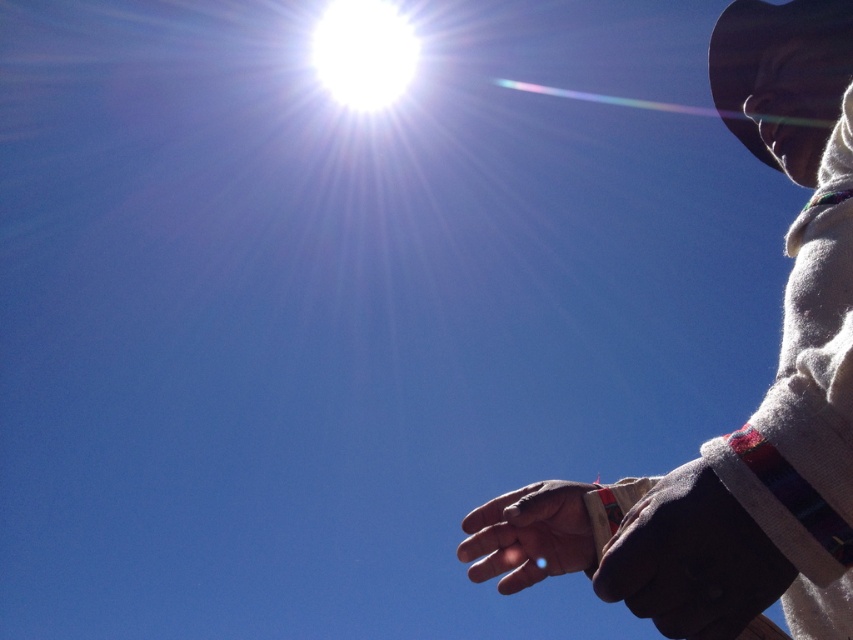
You are an astronomer observing the sky and notice the white bright at upper center and the white woolen sweater at right. Which object is positioned higher in the image?

The white bright at upper center is positioned higher in the image than the white woolen sweater at right.